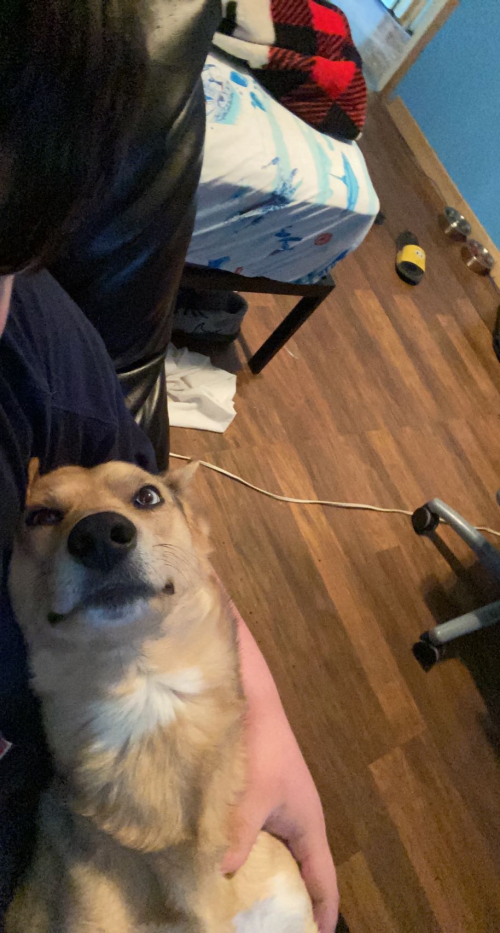
Locate an element on the screen. bed is located at coordinates (328, 170).